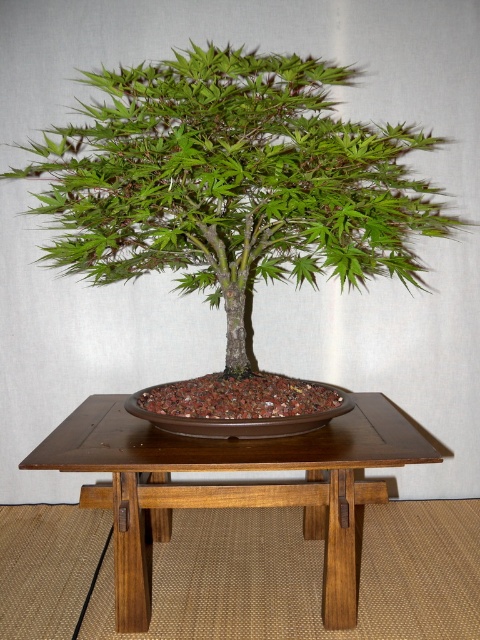
Question: Which object appears farthest from the camera in this image?

Choices:
 (A) brown wood table at center
 (B) green matte bonsai tree at center

Answer: (A)

Question: In this image, where is green matte bonsai tree at center located relative to brown wood table at center?

Choices:
 (A) left
 (B) right

Answer: (A)

Question: Is green matte bonsai tree at center above brown wood table at center?

Choices:
 (A) yes
 (B) no

Answer: (A)

Question: Which object is closer to the camera taking this photo?

Choices:
 (A) green matte bonsai tree at center
 (B) brown wood table at center

Answer: (A)

Question: Which point is farther to the camera?

Choices:
 (A) (151, 442)
 (B) (396, 124)

Answer: (B)

Question: Does green matte bonsai tree at center appear over brown wood table at center?

Choices:
 (A) yes
 (B) no

Answer: (A)